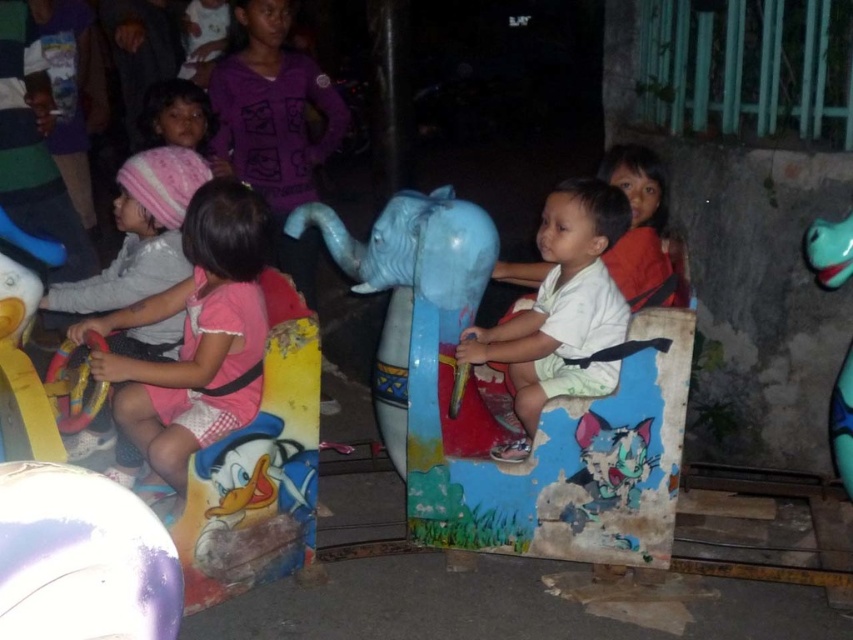
Question: In this image, where is blue painted plastic elephant at center located relative to white matte elephant at center?

Choices:
 (A) left
 (B) right

Answer: (A)

Question: Which is farther from the blue matte elephant at center?

Choices:
 (A) teal rubber elephant at right
 (B) pink fabric dress at left

Answer: (A)

Question: Does blue painted plastic elephant at center appear on the right side of pink fabric dress at left?

Choices:
 (A) no
 (B) yes

Answer: (B)

Question: Which object is positioned closest to the teal rubber elephant at right?

Choices:
 (A) blue painted plastic elephant at center
 (B) pink fabric dress at left
 (C) white matte elephant at center
 (D) blue matte elephant at center

Answer: (C)

Question: Does blue painted plastic elephant at center have a lesser width compared to white matte elephant at center?

Choices:
 (A) no
 (B) yes

Answer: (A)

Question: Which point appears farthest from the camera in this image?

Choices:
 (A) (834, 236)
 (B) (376, 259)
 (C) (584, 371)
 (D) (265, 250)

Answer: (C)